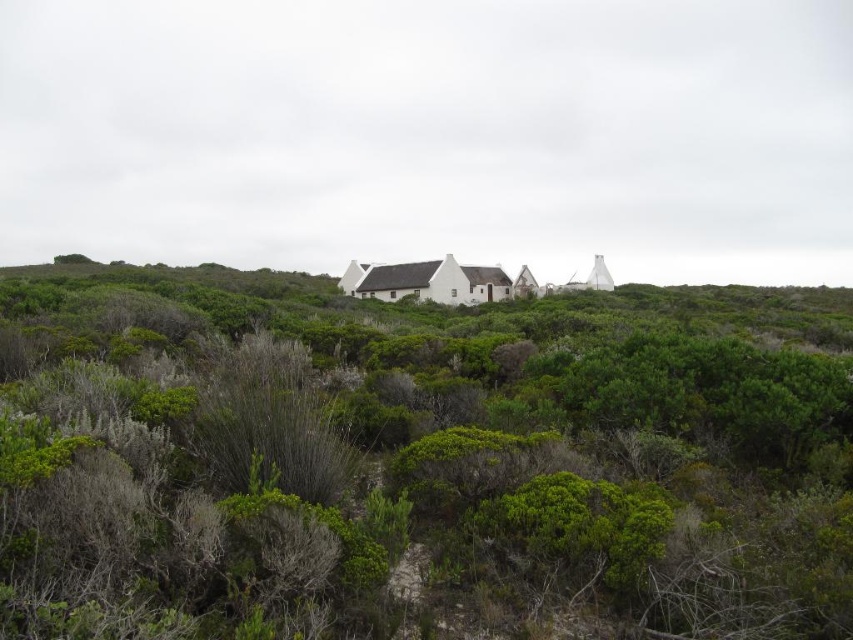
Question: Which of the following is the farthest from the observer?

Choices:
 (A) white matte cottage at center
 (B) green shrubbery at center

Answer: (A)

Question: Can you confirm if green shrubbery at center is positioned to the left of white matte cottage at center?

Choices:
 (A) no
 (B) yes

Answer: (A)

Question: Is green shrubbery at center behind white matte cottage at center?

Choices:
 (A) yes
 (B) no

Answer: (B)

Question: Is the position of green shrubbery at center more distant than that of white matte cottage at center?

Choices:
 (A) no
 (B) yes

Answer: (A)

Question: Among these points, which one is farthest from the camera?

Choices:
 (A) (373, 554)
 (B) (477, 269)

Answer: (B)

Question: Which point is closer to the camera?

Choices:
 (A) green shrubbery at center
 (B) white matte cottage at center

Answer: (A)